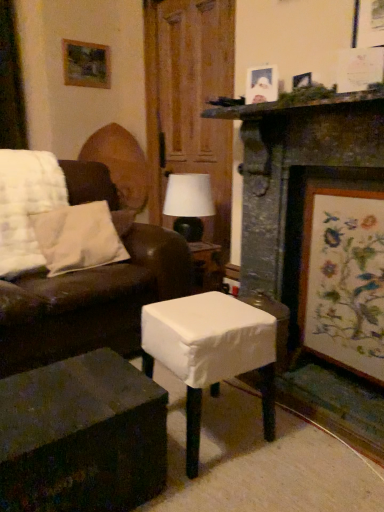
The height and width of the screenshot is (512, 384). What are the coordinates of `vacant space in white fabric-covered stool at center, positioned as the second table in left-to-right order (from a real-world perspective)` in the screenshot? It's located at (211, 429).